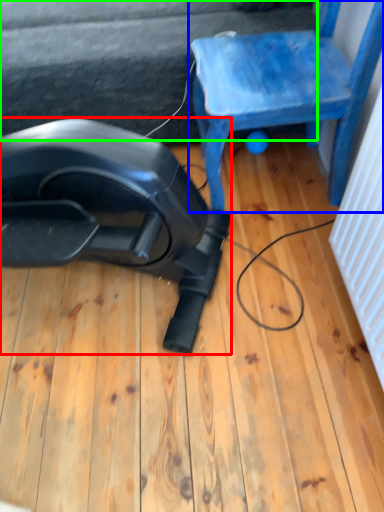
Question: Which is nearer to the equipment (highlighted by a red box)? chair (highlighted by a blue box) or surface (highlighted by a green box).

Choices:
 (A) chair
 (B) surface

Answer: (A)